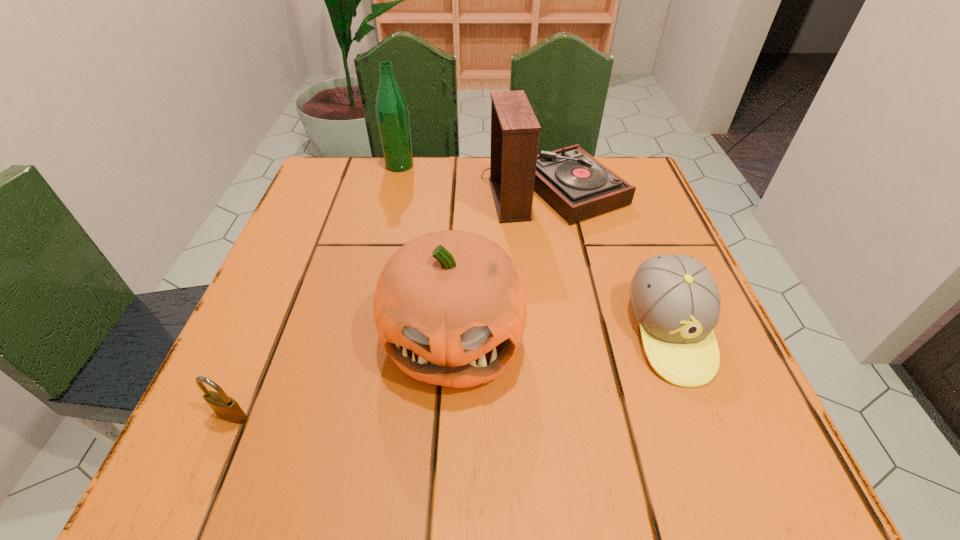
Select which object is the fourth closest to the baseball cap. Please provide its 2D coordinates. Your answer should be formatted as a tuple, i.e. [(x, y)], where the tuple contains the x and y coordinates of a point satisfying the conditions above.

[(227, 408)]